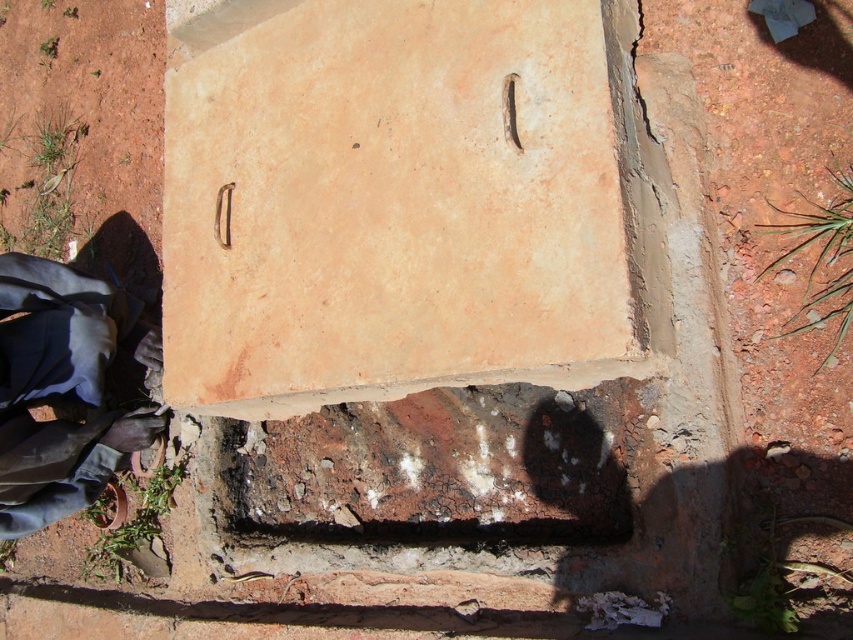
Question: Which object appears farthest from the camera in this image?

Choices:
 (A) dark blue fabric at lower left
 (B) matte clay brick at center

Answer: (A)

Question: Which point is farther to the camera?

Choices:
 (A) dark blue fabric at lower left
 (B) matte clay brick at center

Answer: (A)

Question: Is matte clay brick at center smaller than dark blue fabric at lower left?

Choices:
 (A) yes
 (B) no

Answer: (B)

Question: Is matte clay brick at center positioned behind dark blue fabric at lower left?

Choices:
 (A) no
 (B) yes

Answer: (A)

Question: Can you confirm if matte clay brick at center is positioned to the left of dark blue fabric at lower left?

Choices:
 (A) yes
 (B) no

Answer: (B)